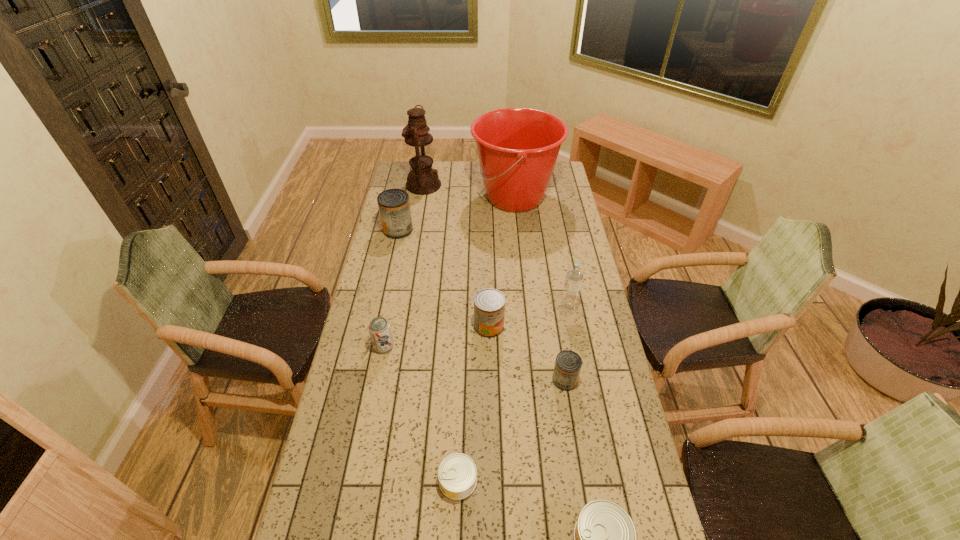
The width and height of the screenshot is (960, 540). Find the location of `the eighth farthest object`. the eighth farthest object is located at coordinates (457, 473).

The width and height of the screenshot is (960, 540). Find the location of `the smaller silver can`. the smaller silver can is located at coordinates (457, 473).

At what (x,y) coordinates should I click in order to perform the action: click on vacant space located 0.240m on the front of the oil lamp. Please return your answer as a coordinate pair (x, y). The width and height of the screenshot is (960, 540). Looking at the image, I should click on (417, 227).

You are a GUI agent. You are given a task and a screenshot of the screen. Output one action in this format:
    pyautogui.click(x=<x>, y=<y>)
    Task: Click on the free region located 0.210m with the handle attached to the rim of the bucket
    The image size is (960, 540).
    Given the screenshot: What is the action you would take?
    pyautogui.click(x=430, y=198)

At what (x,y) coordinates should I click in order to perform the action: click on vacant space located with the handle attached to the rim of the bucket. Please return your answer as a coordinate pair (x, y). This screenshot has width=960, height=540. Looking at the image, I should click on (432, 198).

The width and height of the screenshot is (960, 540). What are the coordinates of `vacant space located with the handle attached to the rim of the bucket` in the screenshot? It's located at (393, 198).

You are a GUI agent. You are given a task and a screenshot of the screen. Output one action in this format:
    pyautogui.click(x=<x>, y=<y>)
    Task: Click on the free space located 0.190m on the left of the third tallest object
    The image size is (960, 540).
    Given the screenshot: What is the action you would take?
    pyautogui.click(x=511, y=309)

In order to click on blank space located 0.170m on the right of the farthest red can in this screenshot , I will do `click(449, 230)`.

Where is `vacant space located 0.290m on the left of the second farthest can`? The image size is (960, 540). vacant space located 0.290m on the left of the second farthest can is located at coordinates (396, 326).

Identify the location of vacant region located 0.400m on the back of the beer can. (399, 264).